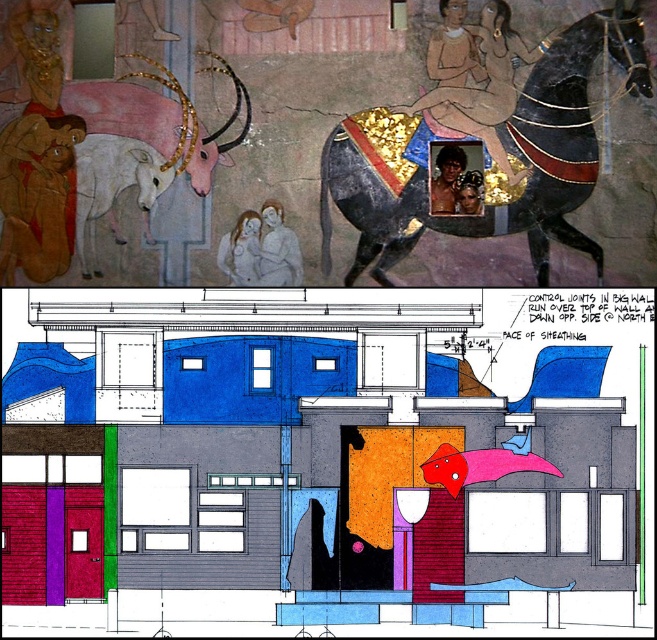
Who is more forward, (468, 129) or (237, 218)?

Point (237, 218) is more forward.

Between matte gold armor at upper center and smooth white figure at center, which one is positioned higher?

matte gold armor at upper center is above.

Which is in front, point (507, 90) or point (252, 211)?

Point (252, 211)

Identify the location of matte gold armor at upper center. (474, 76).

Is matte gold armor at upper center wider than smooth gray figure at center?

Correct, the width of matte gold armor at upper center exceeds that of smooth gray figure at center.

Identify the location of matte gold armor at upper center. Image resolution: width=657 pixels, height=640 pixels. (474, 76).

Where is `matte gold armor at upper center`? Image resolution: width=657 pixels, height=640 pixels. matte gold armor at upper center is located at coordinates (474, 76).

Between shiny black horse at upper right and matte gold armor at upper center, which one appears on the left side from the viewer's perspective?

From the viewer's perspective, matte gold armor at upper center appears more on the left side.

Is point (585, 60) closer to camera compared to point (438, 92)?

No, (585, 60) is behind (438, 92).

What do you see at coordinates (484, 157) in the screenshot? This screenshot has width=657, height=640. I see `shiny black horse at upper right` at bounding box center [484, 157].

The height and width of the screenshot is (640, 657). What are the coordinates of `shiny black horse at upper right` in the screenshot? It's located at (484, 157).